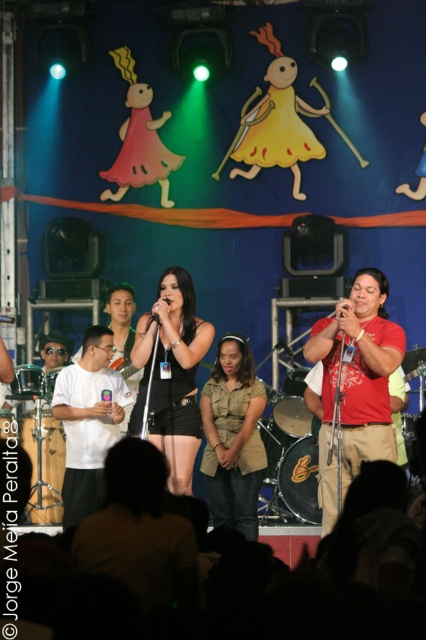
Does black matte dress at center have a lesser height compared to black plastic microphone at center?

No, black matte dress at center is not shorter than black plastic microphone at center.

Who is higher up, black matte dress at center or black plastic microphone at center?

Positioned higher is black plastic microphone at center.

Is point (149, 440) positioned before point (340, 301)?

No, (149, 440) is behind (340, 301).

You are a GUI agent. You are given a task and a screenshot of the screen. Output one action in this format:
    pyautogui.click(x=<x>, y=<y>)
    Task: Click on the black matte dress at center
    Image resolution: width=426 pixels, height=640 pixels.
    Given the screenshot: What is the action you would take?
    pyautogui.click(x=172, y=374)

Describe the element at coordinates (172, 374) in the screenshot. I see `black matte dress at center` at that location.

Which of these two, black matte dress at center or black matte microphone at center, stands shorter?

Standing shorter between the two is black matte microphone at center.

Between point (172, 477) and point (166, 298), which one is positioned behind?

The point (166, 298) is behind.

Identify the location of black matte dress at center. Image resolution: width=426 pixels, height=640 pixels. point(172,374).

Does point (319, 456) come closer to viewer compared to point (163, 336)?

No, (319, 456) is behind (163, 336).

Does point (354, 307) lie behind point (149, 433)?

That is True.

Identify the location of red cotton shirt at center. This screenshot has width=426, height=640. (356, 385).